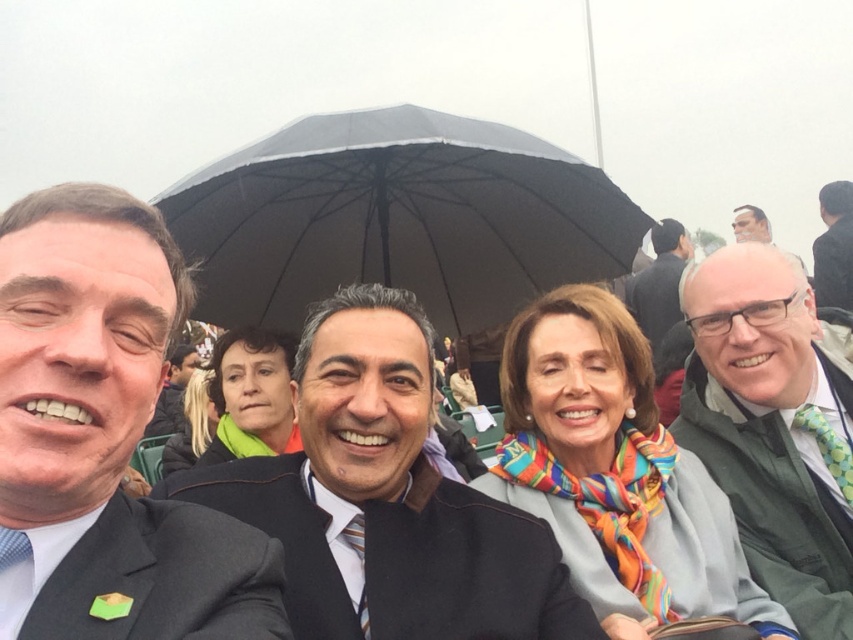
Which is more to the right, green textured jacket at right or matte green scarf at center?

green textured jacket at right is more to the right.

Is point (732, 449) less distant than point (231, 404)?

Yes, point (732, 449) is in front of point (231, 404).

Where is `green textured jacket at right`? This screenshot has height=640, width=853. green textured jacket at right is located at coordinates (773, 428).

I want to click on green textured jacket at right, so click(773, 428).

Can you confirm if black matte umbrella at center is bigger than matte green scarf at center?

Correct, black matte umbrella at center is larger in size than matte green scarf at center.

Between point (527, 225) and point (234, 435), which one is positioned in front?

Point (234, 435)

The width and height of the screenshot is (853, 640). In order to click on black matte umbrella at center in this screenshot , I will do `click(396, 218)`.

Is matte green scarf at center bigger than matte black jacket at center?

No.

Who is positioned more to the left, matte green scarf at center or matte black jacket at center?

matte black jacket at center is more to the left.

Is point (268, 416) in front of point (157, 413)?

Yes, point (268, 416) is in front of point (157, 413).

Find the location of a particular element. Image resolution: width=853 pixels, height=640 pixels. matte green scarf at center is located at coordinates (251, 396).